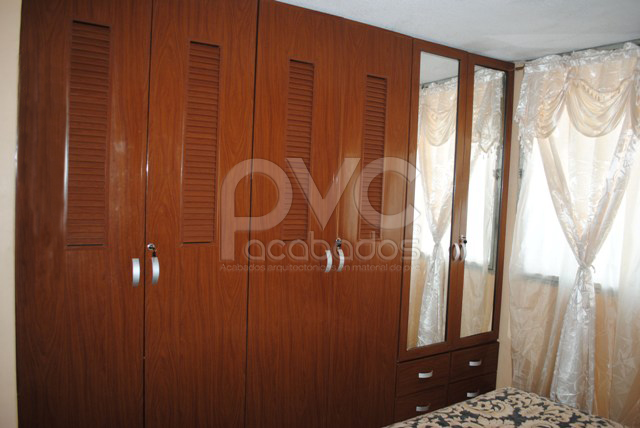
Locate an element on the screen. The image size is (640, 428). white ceiling is located at coordinates (495, 12).